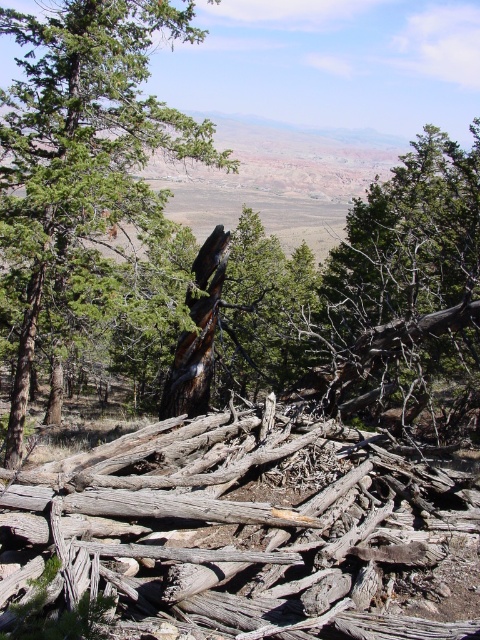
Question: From the image, what is the correct spatial relationship of weathered wood at center in relation to dark brown wood at center?

Choices:
 (A) left
 (B) right

Answer: (B)

Question: Which point is farther to the camera?

Choices:
 (A) brown rough tree trunk at center
 (B) dark brown wood at center

Answer: (A)

Question: Considering the relative positions of weathered wood at center and dark brown wood at center in the image provided, where is weathered wood at center located with respect to dark brown wood at center?

Choices:
 (A) left
 (B) right

Answer: (B)

Question: Which point appears farthest from the camera in this image?

Choices:
 (A) (442, 528)
 (B) (28, 284)
 (C) (223, 266)

Answer: (C)

Question: Which object is positioned farthest from the weathered wood at center?

Choices:
 (A) brown rough tree trunk at center
 (B) dark brown wood at center

Answer: (B)

Question: Can you confirm if weathered wood at center is bigger than brown rough tree trunk at center?

Choices:
 (A) yes
 (B) no

Answer: (B)